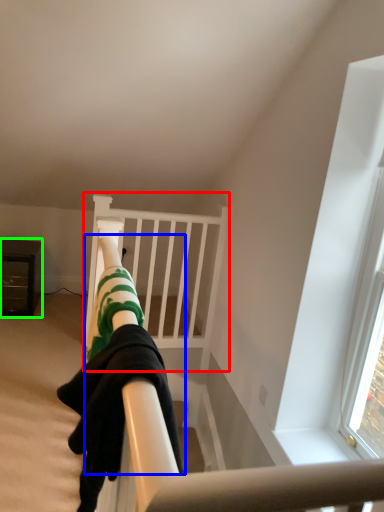
Question: Which object is positioned farthest from bunk bed (highlighted by a red box)? Select from person (highlighted by a blue box) and furniture (highlighted by a green box).

Choices:
 (A) person
 (B) furniture

Answer: (A)